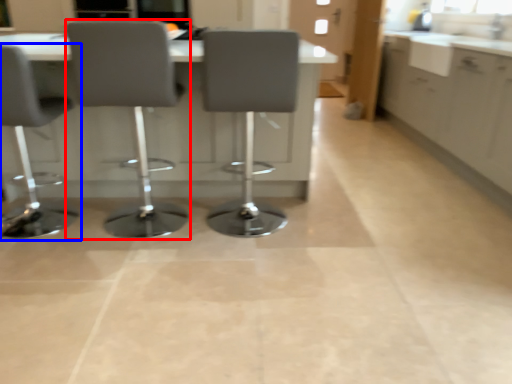
Question: Which object is closer to the camera taking this photo, chair (highlighted by a red box) or chair (highlighted by a blue box)?

Choices:
 (A) chair
 (B) chair

Answer: (A)